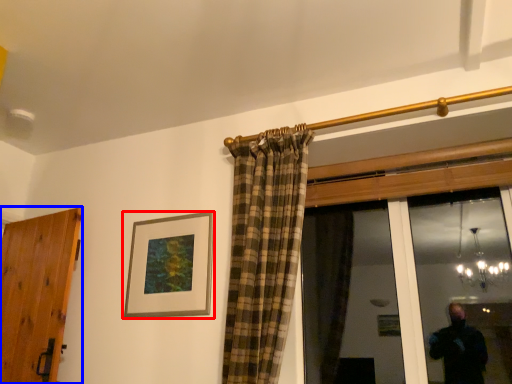
Question: Which of the following is the farthest to the observer, picture frame (highlighted by a red box) or door (highlighted by a blue box)?

Choices:
 (A) picture frame
 (B) door

Answer: (A)